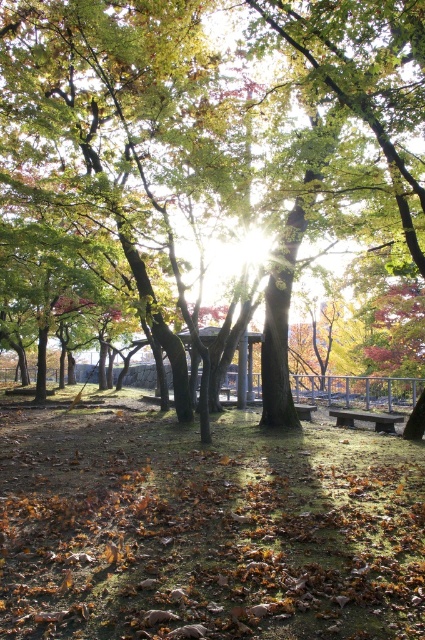
You are standing in the park and see two points marked in the image. The first point is at coordinates point (384, 426) and the second point is at point (300, 417). Which point is closer to you?

Point (384, 426) is in front of point (300, 417), so it is closer to you.

You are planning to sit on one of the benches in the park. Considering the height of the benches, which one would be more comfortable for someone who prefers a lower seat? Please choose between the rustic wood bench at center and the wooden park bench at center.

The rustic wood bench at center has a lesser height compared to the wooden park bench at center, so it would be more comfortable for someone who prefers a lower seat.

You are standing at the center of the park and want to sit down. The rustic wood bench at center is your only option. Can you reach it without stepping on any fallen leaves?

The rustic wood bench at center is located at point (365, 419). Since the ground around it is covered with fallen leaves, you would have to step on them to reach the bench.